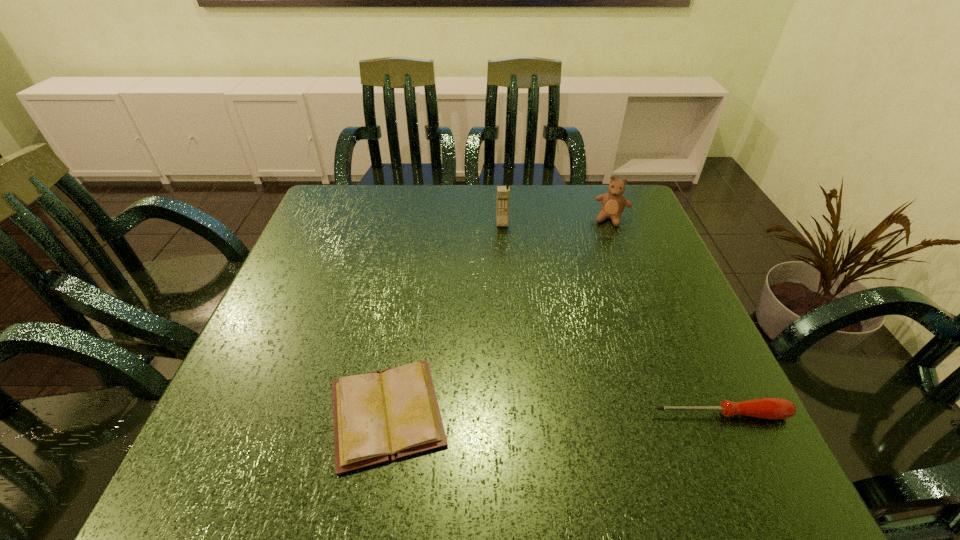
The image size is (960, 540). What are the coordinates of `the shortest object` in the screenshot? It's located at (383, 416).

In order to click on diary in this screenshot , I will do `click(383, 416)`.

Find the location of `screwdriver`. screwdriver is located at coordinates (772, 408).

Identify the location of cellular telephone. The height and width of the screenshot is (540, 960). (503, 192).

Identify the location of the tallest object. (503, 192).

Find the location of `the third shortest object`. the third shortest object is located at coordinates (613, 203).

Find the location of a particular element. Image resolution: width=960 pixels, height=540 pixels. vacant space located on the back of the shortest object is located at coordinates (416, 251).

Image resolution: width=960 pixels, height=540 pixels. I want to click on vacant region located 0.280m on the front of the tallest object, where the keypad is located, so tap(511, 302).

Identify the location of vacant space situated on the front of the tallest object, where the keypad is located. This screenshot has width=960, height=540. (506, 261).

You are a GUI agent. You are given a task and a screenshot of the screen. Output one action in this format:
    pyautogui.click(x=<x>, y=<y>)
    Task: Click on the blank space located 0.150m on the front of the tallest object, where the keypad is located
    Image resolution: width=960 pixels, height=540 pixels.
    Given the screenshot: What is the action you would take?
    pyautogui.click(x=506, y=264)